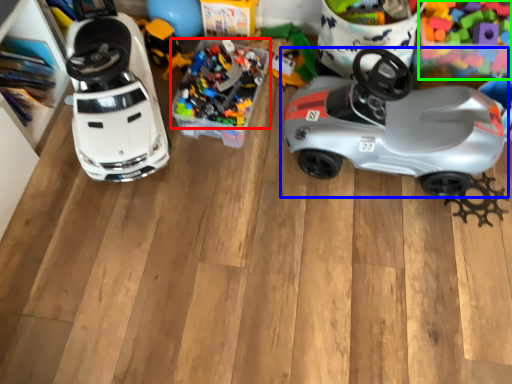
Question: Estimate the real-world distances between objects in this image. Which object is closer to toy (highlighted by a red box), car (highlighted by a blue box) or toy (highlighted by a green box)?

Choices:
 (A) car
 (B) toy

Answer: (A)